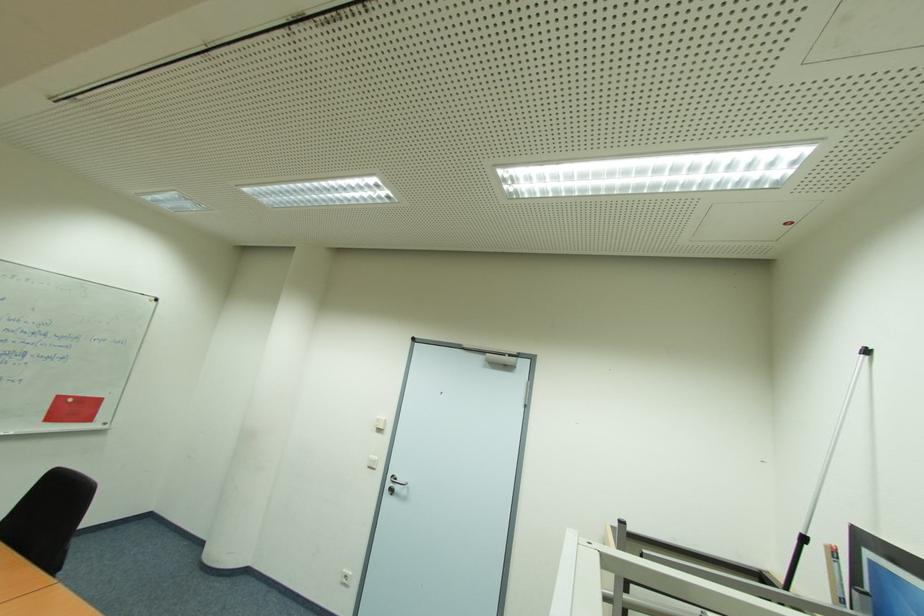
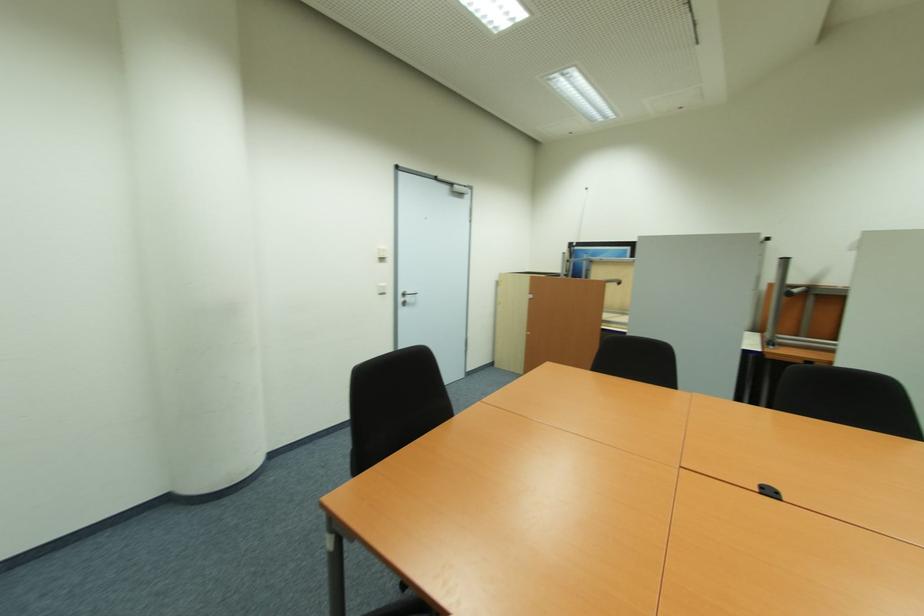
Where in the second image is the point corresponding to point 383,431 from the first image?

(385, 260)